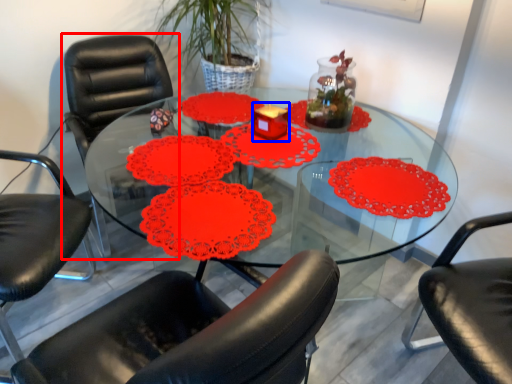
Question: Which object appears closest to the camera in this image, chair (highlighted by a red box) or candle holder (highlighted by a blue box)?

Choices:
 (A) chair
 (B) candle holder

Answer: (A)